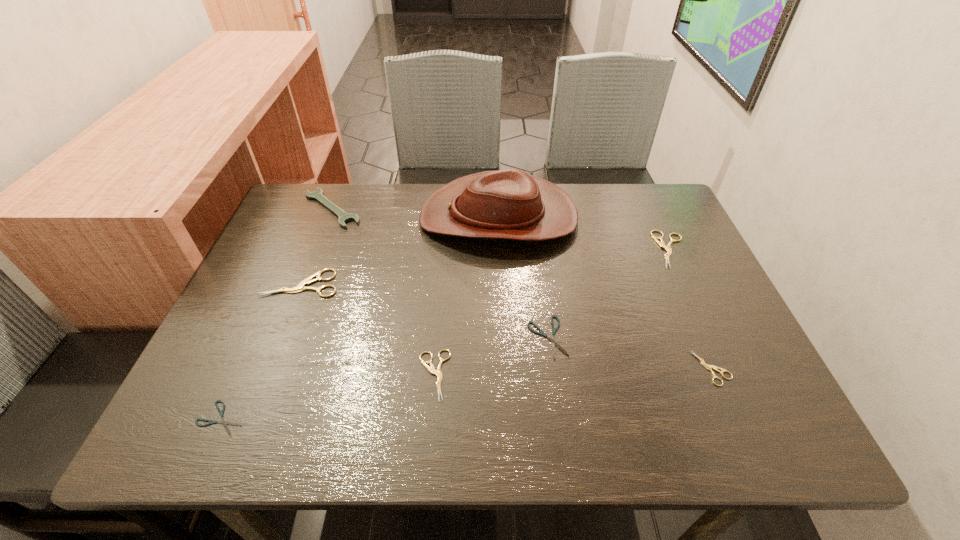
Identify which shears is the fifth nearest to the fourth farthest object. Please provide its 2D coordinates. Your answer should be formatted as a tuple, i.e. [(x, y)], where the tuple contains the x and y coordinates of a point satisfying the conditions above.

[(661, 243)]

Locate which beige shears is the second closest to the third shears from right to left. Please provide its 2D coordinates. Your answer should be formatted as a tuple, i.e. [(x, y)], where the tuple contains the x and y coordinates of a point satisfying the conditions above.

[(704, 364)]

Identify which beige shears is the nearest to the farther black shears. Please provide its 2D coordinates. Your answer should be formatted as a tuple, i.e. [(x, y)], where the tuple contains the x and y coordinates of a point satisfying the conditions above.

[(438, 373)]

You are a GUI agent. You are given a task and a screenshot of the screen. Output one action in this format:
    pyautogui.click(x=<x>, y=<y>)
    Task: Click on the blank area in the image that satisfies the following two spatial constraints: 1. on the front-facing side of the cowboy hat; 2. on the back side of the smallest beige shears
    The image size is (960, 540).
    Given the screenshot: What is the action you would take?
    pyautogui.click(x=505, y=368)

Find the location of a particular element. free space in the image that satisfies the following two spatial constraints: 1. on the front-facing side of the cowboy hat; 2. on the right side of the right black shears is located at coordinates (504, 338).

Where is `blank area in the image that satisfies the following two spatial constraints: 1. on the front side of the tallest shears; 2. on the right side of the farther black shears`? blank area in the image that satisfies the following two spatial constraints: 1. on the front side of the tallest shears; 2. on the right side of the farther black shears is located at coordinates (279, 338).